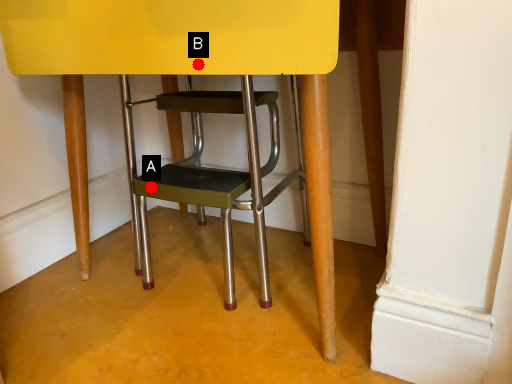
Question: Two points are circled on the image, labeled by A and B beside each circle. Which point is closer to the camera?

Choices:
 (A) A is closer
 (B) B is closer

Answer: (B)